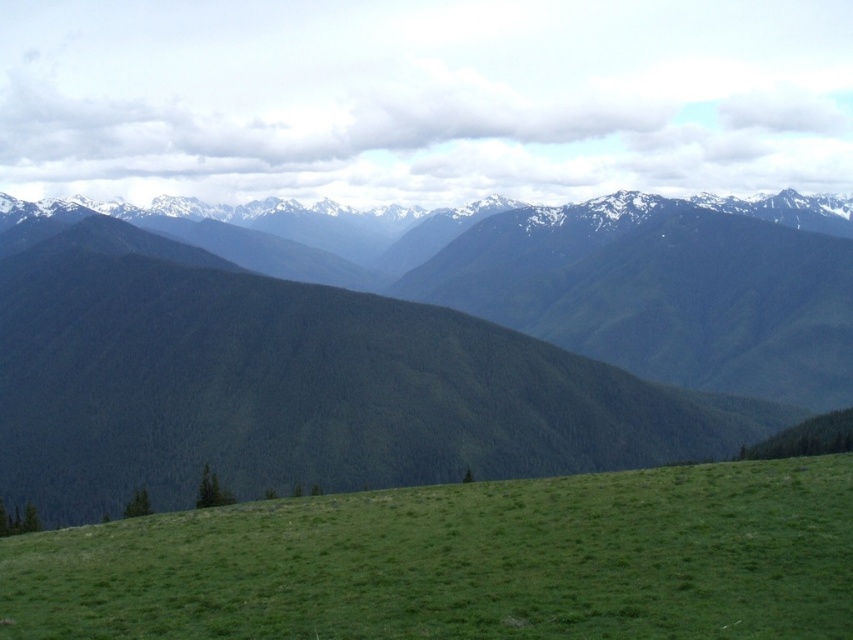
You are planning to hike from the green grassy hill at lower center to the green forested mountain at center. Considering their sizes, which one will require more energy to climb?

The green forested mountain at center requires more energy to climb because it is larger in size than the green grassy hill at lower center.